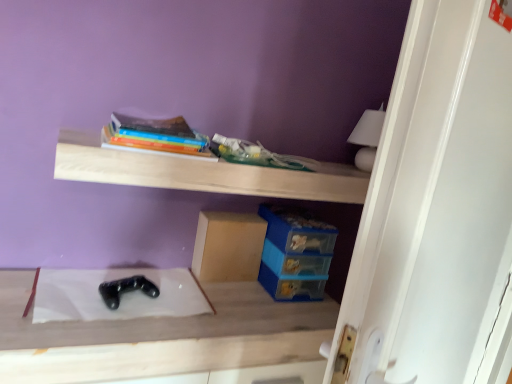
Question: From their relative heights in the image, would you say wooden shelf at upper center is taller or shorter than hardcover book at upper center?

Choices:
 (A) short
 (B) tall

Answer: (A)

Question: Is wooden shelf at upper center bigger or smaller than hardcover book at upper center?

Choices:
 (A) small
 (B) big

Answer: (B)

Question: Which is farther from the black matte game controller at lower center?

Choices:
 (A) white glossy door at upper right
 (B) hardcover book at upper center
 (C) matte cardboard box at center
 (D) wooden shelf at upper center
 (E) black matte game controller at center

Answer: (A)

Question: Which of these objects is positioned closest to the black matte game controller at center?

Choices:
 (A) hardcover book at upper center
 (B) wooden shelf at upper center
 (C) matte cardboard box at center
 (D) white glossy door at upper right
 (E) black matte game controller at lower center

Answer: (E)